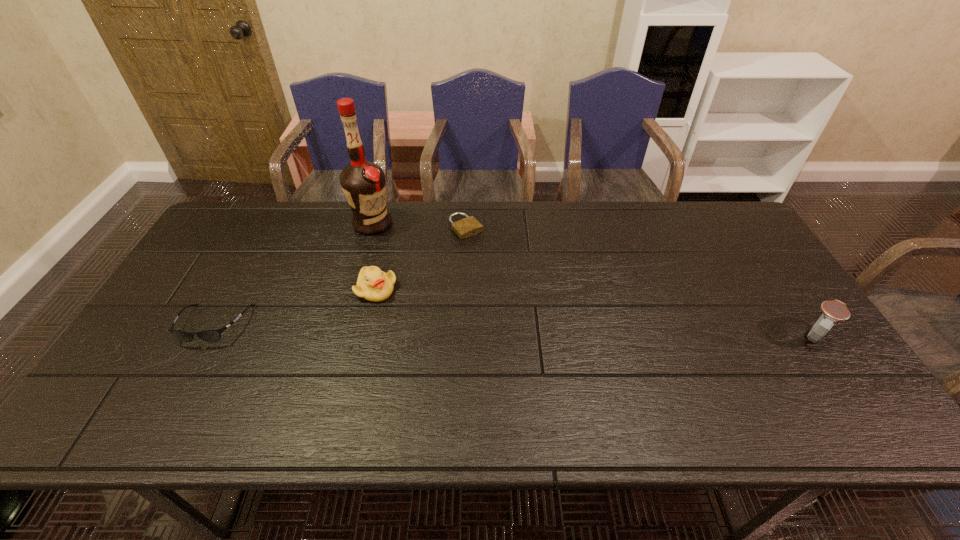
At what (x,y) coordinates should I click in order to perform the action: click on free area in between the rightmost object and the third tallest object. Please return your answer as a coordinate pair (x, y). This screenshot has height=540, width=960. Looking at the image, I should click on (x=595, y=313).

Find the location of a particular element. The image size is (960, 540). free space between the watch and the liquor is located at coordinates (592, 280).

Locate an element on the screen. The width and height of the screenshot is (960, 540). vacant space that's between the shortest object and the sunglasses is located at coordinates (340, 276).

The image size is (960, 540). Identify the location of unoccupied area between the tallest object and the second object from right to left. (419, 226).

Image resolution: width=960 pixels, height=540 pixels. I want to click on empty location between the sunglasses and the shortest object, so click(340, 276).

At what (x,y) coordinates should I click in order to perform the action: click on vacant point located between the sunglasses and the liquor. Please return your answer as a coordinate pair (x, y). The height and width of the screenshot is (540, 960). Looking at the image, I should click on (293, 274).

Locate an element on the screen. Image resolution: width=960 pixels, height=540 pixels. empty location between the third tallest object and the padlock is located at coordinates (421, 259).

You are a GUI agent. You are given a task and a screenshot of the screen. Output one action in this format:
    pyautogui.click(x=<x>, y=<y>)
    Task: Click on the vacant point located between the third shortest object and the padlock
    The width and height of the screenshot is (960, 540).
    Given the screenshot: What is the action you would take?
    pyautogui.click(x=421, y=259)

I want to click on vacant region between the tallest object and the second shortest object, so click(x=293, y=274).

Select which object is the second closest to the third farthest object. Please provide its 2D coordinates. Your answer should be formatted as a tuple, i.e. [(x, y)], where the tuple contains the x and y coordinates of a point satisfying the conditions above.

[(469, 226)]